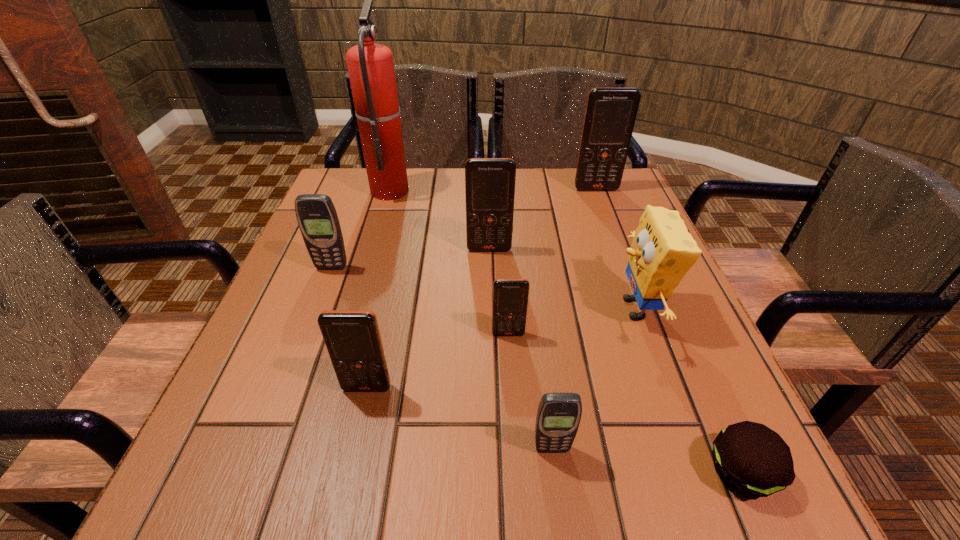
Where is `blank space at the right edge of the desktop`? This screenshot has height=540, width=960. blank space at the right edge of the desktop is located at coordinates (587, 220).

You are a GUI agent. You are given a task and a screenshot of the screen. Output one action in this format:
    pyautogui.click(x=<x>, y=<y>)
    Task: Click on the free space that is in between the tallest object and the smaller gray cellular telephone
    This screenshot has width=960, height=540.
    Given the screenshot: What is the action you would take?
    pyautogui.click(x=471, y=319)

Where is `free spot between the right gray cellular telephone and the tallest object`? This screenshot has width=960, height=540. free spot between the right gray cellular telephone and the tallest object is located at coordinates (471, 319).

Image resolution: width=960 pixels, height=540 pixels. Find the location of `empty location between the fifth farthest cellular telephone and the second farthest cellular telephone`. empty location between the fifth farthest cellular telephone and the second farthest cellular telephone is located at coordinates click(x=428, y=319).

The height and width of the screenshot is (540, 960). What are the coordinates of `free point between the yellow sponge and the second nearest cellular telephone` in the screenshot? It's located at (501, 348).

Where is `free spot between the nearest orange cellular telephone and the rightmost cellular telephone`? free spot between the nearest orange cellular telephone and the rightmost cellular telephone is located at coordinates (482, 288).

Identify the location of free space between the smaller gray cellular telephone and the second tallest object. The height and width of the screenshot is (540, 960). (574, 319).

Locate an element on the screen. free area in between the smaller gray cellular telephone and the second farthest orange cellular telephone is located at coordinates (520, 349).

Identify the location of free spot between the right gray cellular telephone and the second cellular telephone from left to right. The width and height of the screenshot is (960, 540). pos(460,418).

This screenshot has height=540, width=960. I want to click on free spot between the rightmost cellular telephone and the fourth farthest cellular telephone, so click(x=552, y=261).